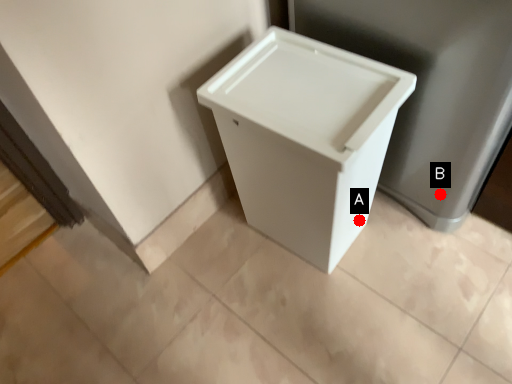
Question: Two points are circled on the image, labeled by A and B beside each circle. Which point is closer to the camera?

Choices:
 (A) A is closer
 (B) B is closer

Answer: (B)